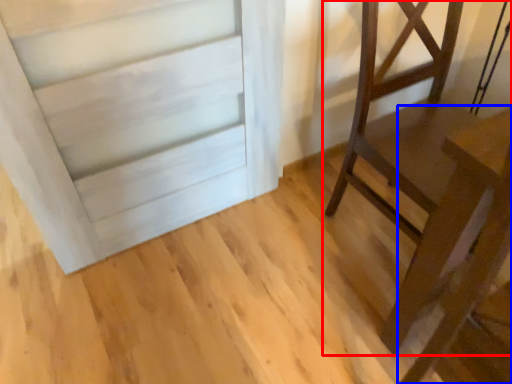
Question: Among these objects, which one is nearest to the camera, furniture (highlighted by a red box) or table (highlighted by a blue box)?

Choices:
 (A) furniture
 (B) table

Answer: (B)